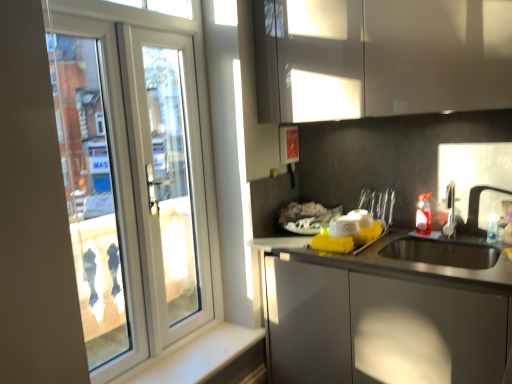
I want to click on empty space that is ontop of white plastic screen door at left (from a real-world perspective), so click(159, 27).